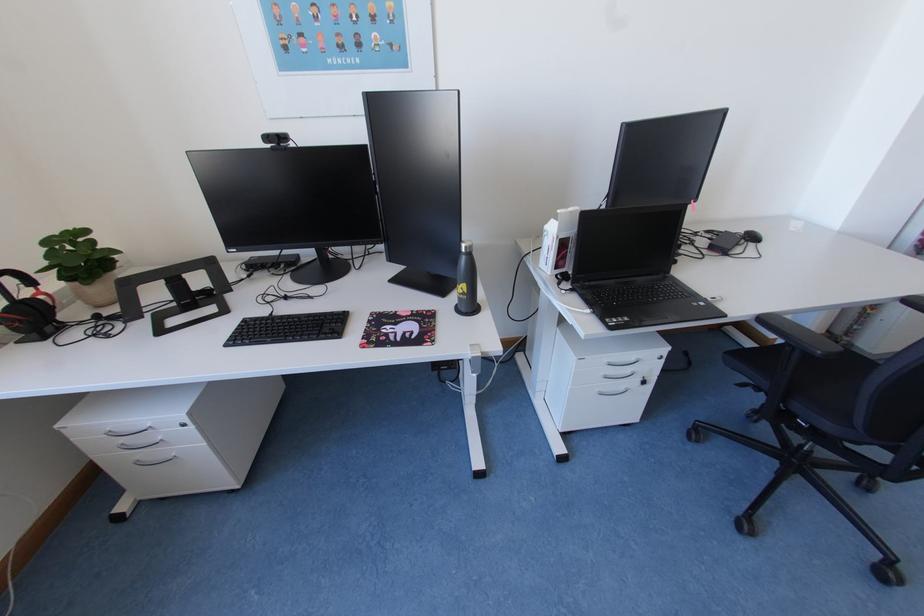
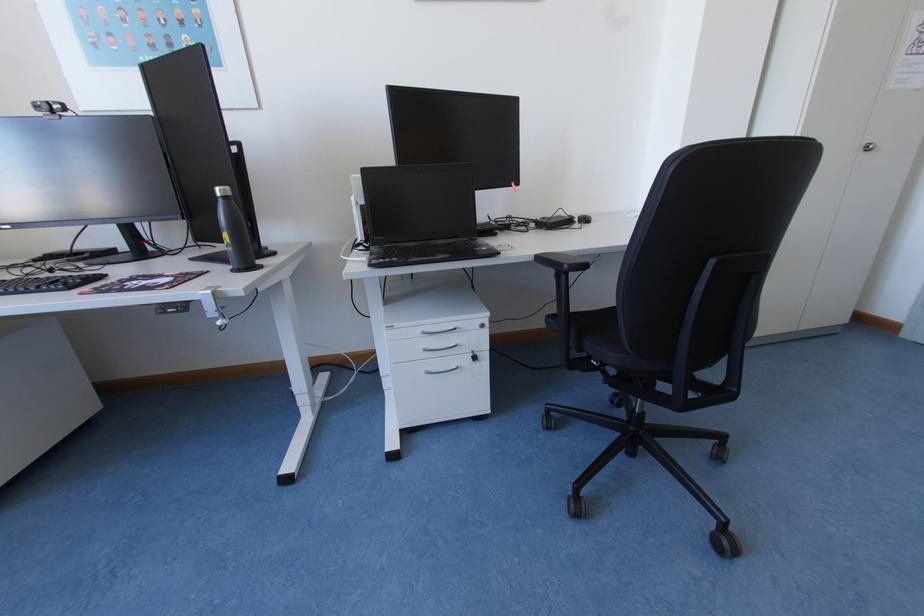
Question: Which direction would the cameraman need to move to produce the second image? Reply with the corresponding letter.

Choices:
 (A) Left
 (B) Right
 (C) Forward
 (D) Backward

Answer: (B)